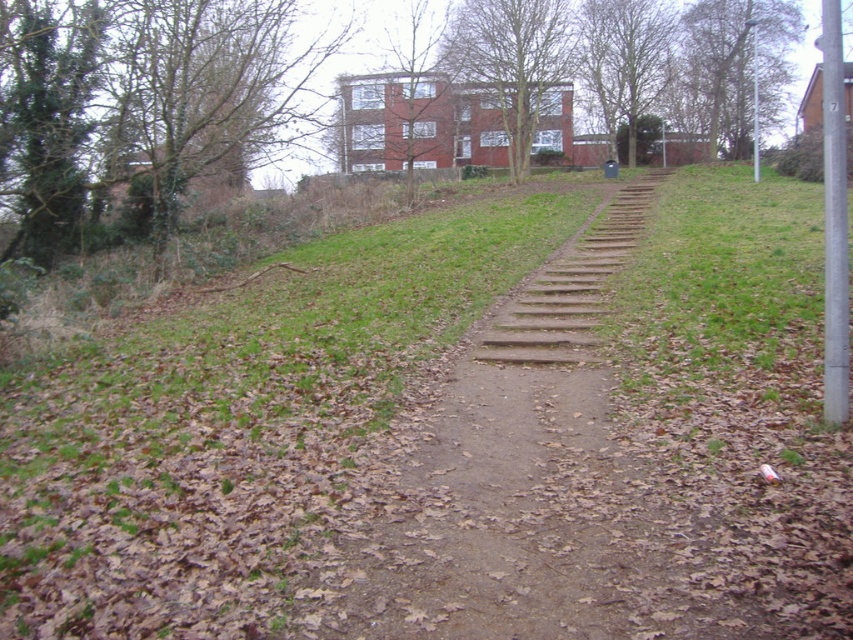
You are a gardener planning to mow the green grassy at center and the dirt path at center. Which area should you mow first if you want to start from the left side?

The green grassy at center should be mowed first because it is positioned on the left side of the dirt path at center.

You are a delivery person carrying a heavy package and need to reach the building at the top of the slope. The dirt path at center and wooden stairs at center are your options. Which path should you choose to avoid climbing stairs?

The dirt path at center is located below wooden stairs at center, so you should choose the dirt path at center to reach the building without climbing the wooden stairs at center.